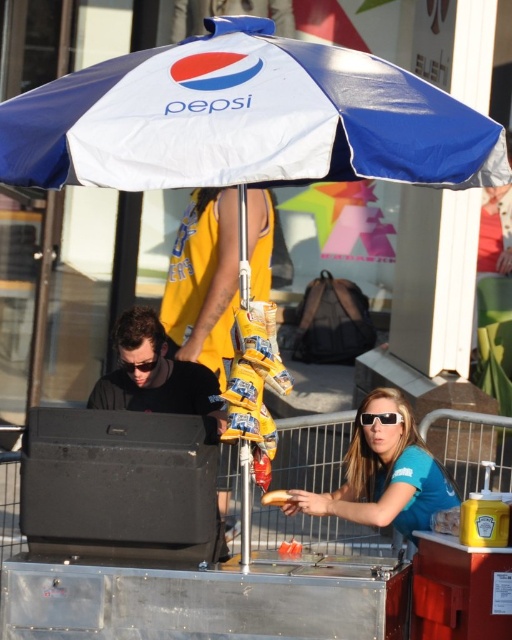
Who is lower down, black matte speaker at lower left or clear plastic sunglasses at lower center?

clear plastic sunglasses at lower center is below.

Does black matte speaker at lower left appear on the left side of clear plastic sunglasses at lower center?

Yes, black matte speaker at lower left is to the left of clear plastic sunglasses at lower center.

Who is more distant from viewer, (142, 332) or (364, 417)?

Point (142, 332)

You are a GUI agent. You are given a task and a screenshot of the screen. Output one action in this format:
    pyautogui.click(x=<x>, y=<y>)
    Task: Click on the black matte speaker at lower left
    This screenshot has width=512, height=640.
    Given the screenshot: What is the action you would take?
    pyautogui.click(x=155, y=374)

Is black matte speaker at lower left in front of golden crispy french fry at center?

Yes, it is.

I want to click on black matte speaker at lower left, so click(x=155, y=374).

Is blue fabric sunglasses at center above golden crispy french fry at center?

Correct, blue fabric sunglasses at center is located above golden crispy french fry at center.

Between blue fabric sunglasses at center and golden crispy french fry at center, which one is positioned higher?

blue fabric sunglasses at center

Is point (402, 444) behind point (276, 504)?

Yes, point (402, 444) is behind point (276, 504).

You are a GUI agent. You are given a task and a screenshot of the screen. Output one action in this format:
    pyautogui.click(x=<x>, y=<y>)
    Task: Click on the blue fabric sunglasses at center
    
    Given the screenshot: What is the action you would take?
    pyautogui.click(x=385, y=474)